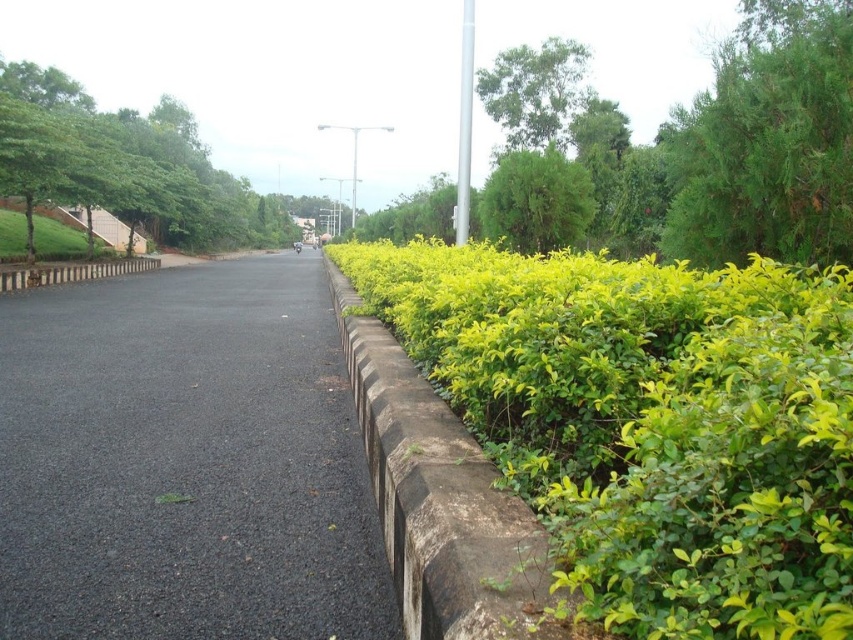
Who is lower down, green leafy hedge at right or black asphalt pavement at center?

black asphalt pavement at center is lower down.

What are the coordinates of `green leafy hedge at right` in the screenshot? It's located at (650, 422).

Is green leafy hedge at right positioned at the back of concrete at right?

No, green leafy hedge at right is in front of concrete at right.

Can you confirm if green leafy hedge at right is bigger than concrete at right?

Yes, green leafy hedge at right is bigger than concrete at right.

Locate an element on the screen. green leafy hedge at right is located at coordinates tap(650, 422).

Where is `green leafy hedge at right`? This screenshot has height=640, width=853. green leafy hedge at right is located at coordinates point(650,422).

Between green leafy bush at right and green leafy tree at upper right, which one appears on the left side from the viewer's perspective?

green leafy bush at right

Does point (492, 182) come behind point (740, 250)?

Yes, point (492, 182) is farther from viewer.

The height and width of the screenshot is (640, 853). What are the coordinates of `green leafy bush at right` in the screenshot? It's located at (712, 157).